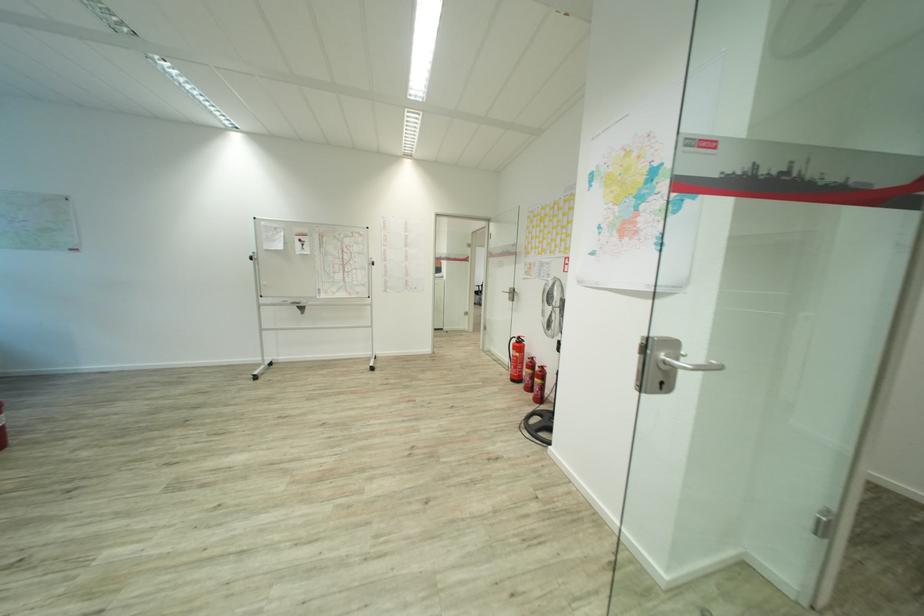
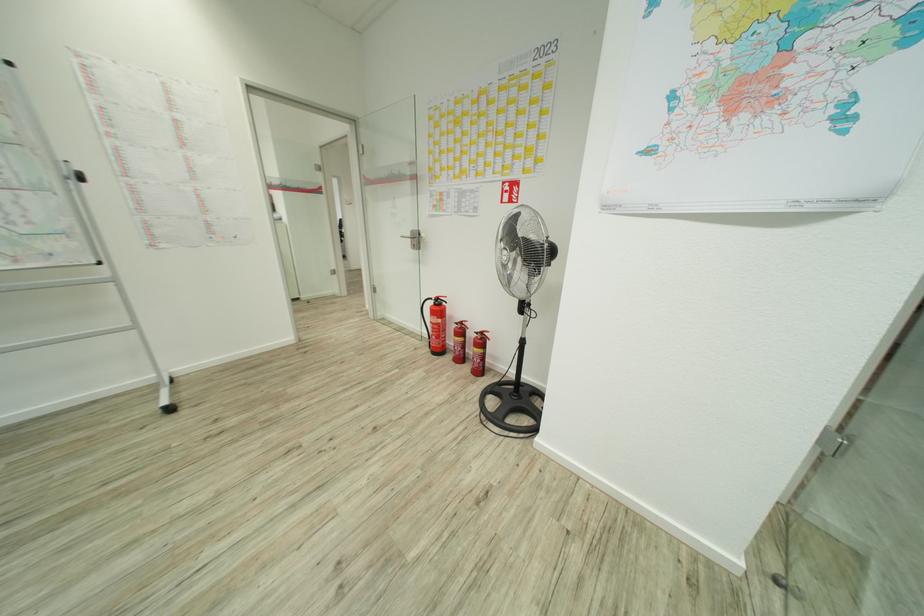
Find the pixel in the second image that matches (x=531, y=358) in the first image.

(459, 322)